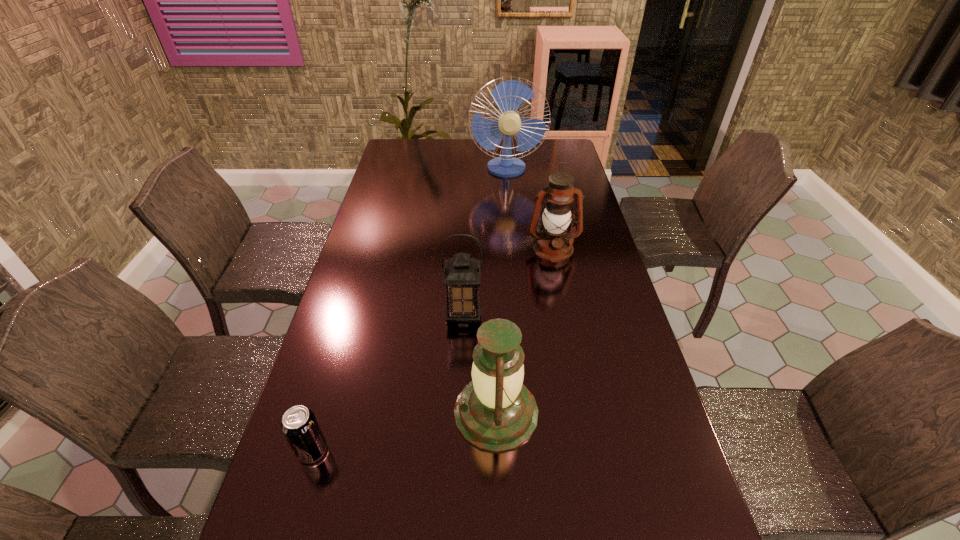
You are a GUI agent. You are given a task and a screenshot of the screen. Output one action in this format:
    pyautogui.click(x=<x>, y=<y>)
    Task: Click on the free space at the far edge of the desktop
    This screenshot has width=960, height=540.
    Given the screenshot: What is the action you would take?
    pyautogui.click(x=461, y=161)

The height and width of the screenshot is (540, 960). I want to click on vacant space at the left edge of the desktop, so click(x=378, y=310).

I want to click on vacant position at the right edge of the desktop, so click(628, 345).

Locate an element on the screen. free region at the far left corner of the desktop is located at coordinates (400, 154).

Where is `free space between the nearest lantern and the soda can`? This screenshot has height=540, width=960. free space between the nearest lantern and the soda can is located at coordinates (404, 431).

Where is `empty space that is in between the farthest lantern and the farthest object`? empty space that is in between the farthest lantern and the farthest object is located at coordinates (530, 208).

Identify the location of vacant space that's between the tallest object and the soda can. (409, 310).

This screenshot has height=540, width=960. I want to click on vacant area that lies between the nearest lantern and the fan, so click(501, 291).

Image resolution: width=960 pixels, height=540 pixels. In order to click on free point between the farthest object and the farthest lantern in this screenshot , I will do `click(530, 208)`.

Locate an element on the screen. Image resolution: width=960 pixels, height=540 pixels. free area in between the farthest lantern and the farthest object is located at coordinates (530, 208).